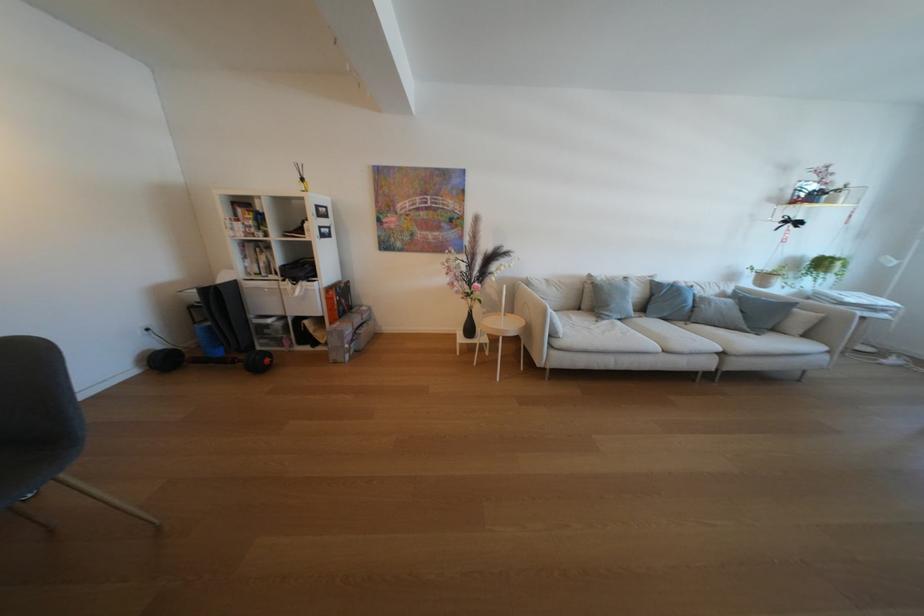
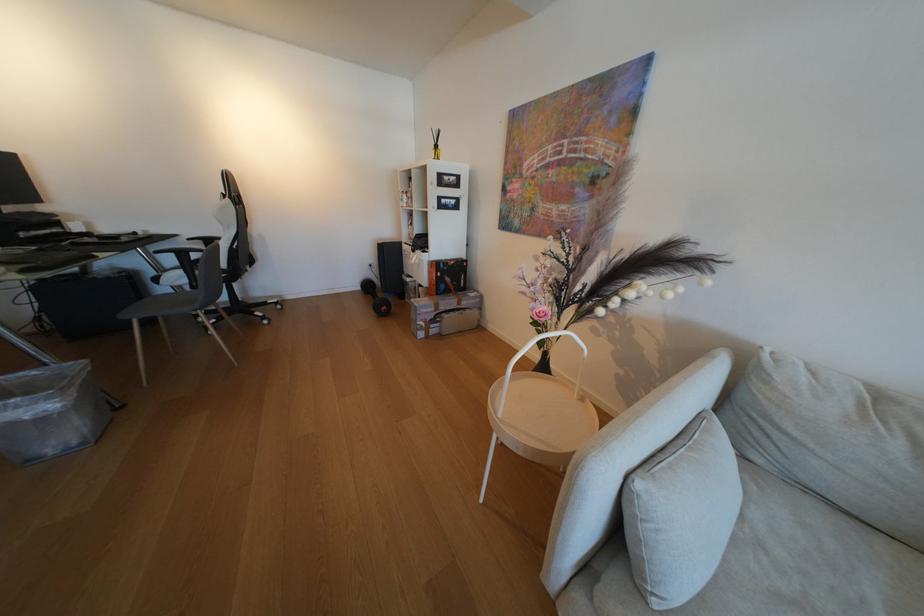
Find the pixel in the second image that matches the point at 363,341 in the first image.

(444, 322)